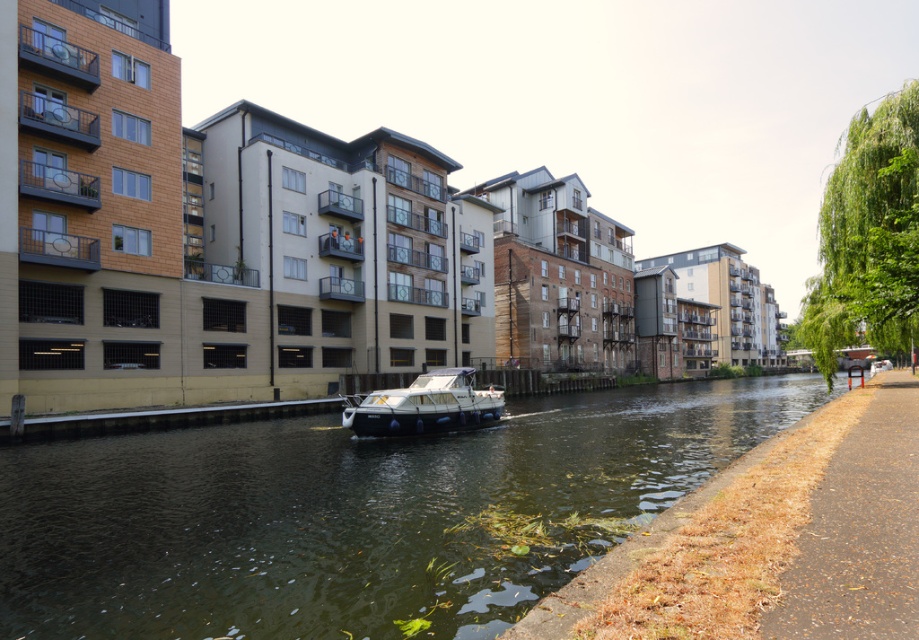
Question: Considering the real-world distances, which object is closest to the white glossy boat at center?

Choices:
 (A) brown asphalt path at lower right
 (B) greenish water at center

Answer: (B)

Question: Does brown asphalt path at lower right have a larger size compared to white glossy boat at center?

Choices:
 (A) yes
 (B) no

Answer: (B)

Question: Which of the following is the farthest from the observer?

Choices:
 (A) (85, 531)
 (B) (831, 566)
 (C) (350, 410)

Answer: (C)

Question: Considering the real-world distances, which object is closest to the white glossy boat at center?

Choices:
 (A) brown asphalt path at lower right
 (B) greenish water at center

Answer: (B)

Question: Is brown asphalt path at lower right below white glossy boat at center?

Choices:
 (A) yes
 (B) no

Answer: (B)

Question: Does greenish water at center come behind white glossy boat at center?

Choices:
 (A) yes
 (B) no

Answer: (B)